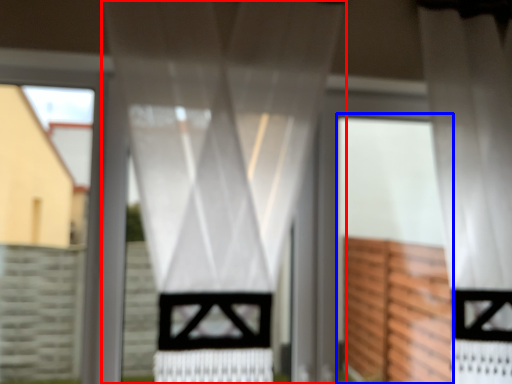
Question: Which object appears farthest to the camera in this image, curtain (highlighted by a red box) or screen door (highlighted by a blue box)?

Choices:
 (A) curtain
 (B) screen door

Answer: (B)